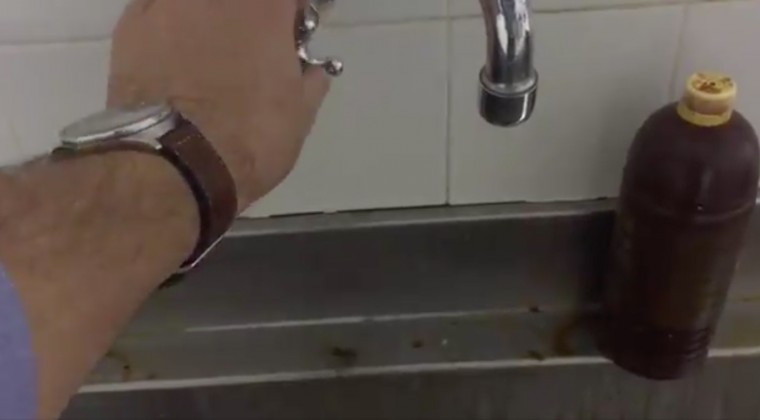
What are the coordinates of `faucet handle` in the screenshot? It's located at (295, 45).